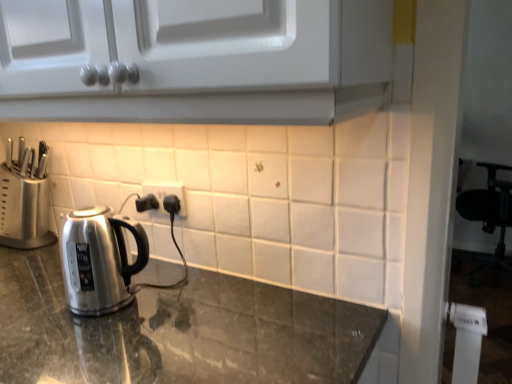
Question: Considering the relative positions of white plastic electric outlet at center and satin silver knife block at left in the image provided, is white plastic electric outlet at center to the right of satin silver knife block at left from the viewer's perspective?

Choices:
 (A) no
 (B) yes

Answer: (B)

Question: Can you confirm if white plastic electric outlet at center is wider than satin silver knife block at left?

Choices:
 (A) no
 (B) yes

Answer: (A)

Question: From the image's perspective, is white plastic electric outlet at center under satin silver knife block at left?

Choices:
 (A) yes
 (B) no

Answer: (A)

Question: Does white plastic electric outlet at center have a lesser width compared to satin silver knife block at left?

Choices:
 (A) no
 (B) yes

Answer: (B)

Question: Can satin silver knife block at left be found inside white plastic electric outlet at center?

Choices:
 (A) yes
 (B) no

Answer: (B)

Question: Is white plastic electric outlet at center shorter than satin silver knife block at left?

Choices:
 (A) no
 (B) yes

Answer: (B)

Question: Is shiny granite countertop at center far from white plastic electric outlet at center?

Choices:
 (A) no
 (B) yes

Answer: (A)

Question: Is shiny granite countertop at center at the left side of white plastic electric outlet at center?

Choices:
 (A) yes
 (B) no

Answer: (A)

Question: Can you confirm if shiny granite countertop at center is thinner than white plastic electric outlet at center?

Choices:
 (A) no
 (B) yes

Answer: (A)

Question: Is shiny granite countertop at center facing away from white plastic electric outlet at center?

Choices:
 (A) no
 (B) yes

Answer: (A)

Question: Considering the relative sizes of shiny granite countertop at center and white plastic electric outlet at center in the image provided, is shiny granite countertop at center bigger than white plastic electric outlet at center?

Choices:
 (A) no
 (B) yes

Answer: (B)

Question: Is shiny granite countertop at center wider than white plastic electric outlet at center?

Choices:
 (A) yes
 (B) no

Answer: (A)

Question: Is shiny granite countertop at center facing towards satin silver knife block at left?

Choices:
 (A) no
 (B) yes

Answer: (A)